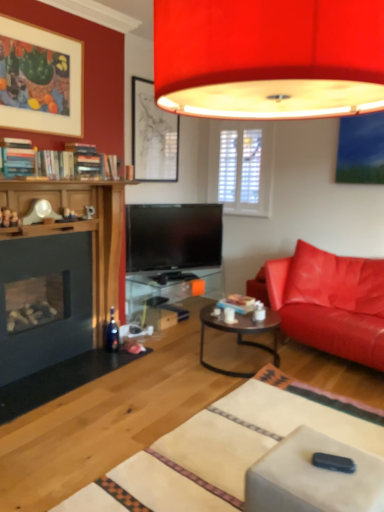
Question: From the image's perspective, relative to matte black coffee table at center, is matte red lampshade at upper center above or below?

Choices:
 (A) above
 (B) below

Answer: (A)

Question: Is matte red lampshade at upper center wider or thinner than matte black coffee table at center?

Choices:
 (A) thin
 (B) wide

Answer: (B)

Question: Considering the real-world distances, which object is farthest from the matte black picture frame at upper center, the 2th picture frame when ordered from front to back?

Choices:
 (A) matte white picture frame at upper left, the 1th picture frame when ordered from front to back
 (B) leather couch at right
 (C) black plastic swivel chair at center
 (D) matte black coffee table at center
 (E) transparent glass table at center

Answer: (C)

Question: Which of these objects is positioned closest to the matte black picture frame at upper center, the 1th picture frame from the right?

Choices:
 (A) transparent glass table at center
 (B) leather couch at right
 (C) black plastic swivel chair at center
 (D) matte black coffee table at center
 (E) matte red lampshade at upper center

Answer: (A)